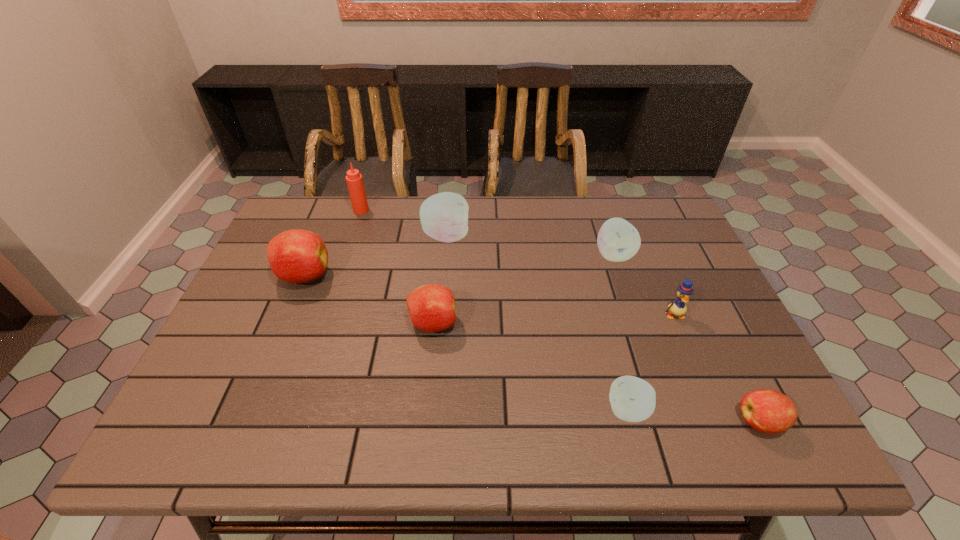
Find the location of `Tabasco sauce at the far edge`. Tabasco sauce at the far edge is located at coordinates (354, 179).

Where is `apple positioned at the far edge`? This screenshot has width=960, height=540. apple positioned at the far edge is located at coordinates (444, 216).

Where is `object located in the left edge section of the desktop`? This screenshot has height=540, width=960. object located in the left edge section of the desktop is located at coordinates (296, 256).

Where is `duckling present at the right edge`? The height and width of the screenshot is (540, 960). duckling present at the right edge is located at coordinates (678, 307).

Image resolution: width=960 pixels, height=540 pixels. I want to click on apple that is positioned at the right edge, so click(x=768, y=411).

Identify the location of object that is at the near right corner. The width and height of the screenshot is (960, 540). (768, 411).

Where is `vacant space at the far edge of the desktop`? The image size is (960, 540). vacant space at the far edge of the desktop is located at coordinates (361, 217).

Identify the location of free region at the near edge of the desktop. This screenshot has width=960, height=540. (610, 452).

In the image, there is a desktop. Find the location of `vacant space at the left edge`. vacant space at the left edge is located at coordinates (288, 332).

In the image, there is a desktop. Where is `free space at the far right corner`? free space at the far right corner is located at coordinates (666, 212).